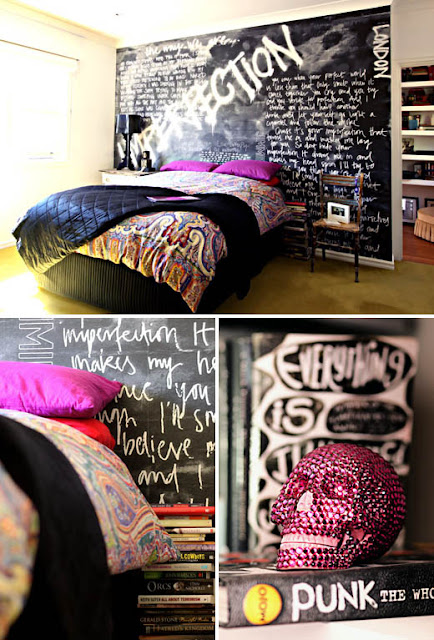
You are a GUI agent. You are given a task and a screenshot of the screen. Output one action in this format:
    pyautogui.click(x=<x>, y=<y>)
    Task: Click on the red pillow
    Image resolution: width=434 pixels, height=640 pixels.
    Given the screenshot: What is the action you would take?
    pyautogui.click(x=95, y=427), pyautogui.click(x=273, y=182)